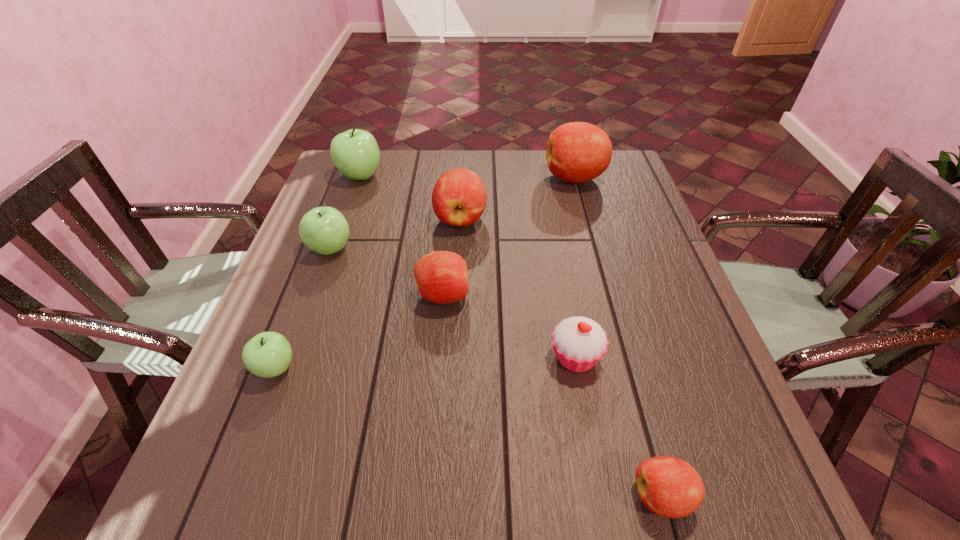
This screenshot has width=960, height=540. In order to click on the nearest object in this screenshot , I will do `click(668, 486)`.

The image size is (960, 540). I want to click on vacant space located 0.060m on the left of the biggest red apple, so point(525,178).

This screenshot has height=540, width=960. In order to click on free space located 0.210m on the front of the farthest green apple in this screenshot , I will do `click(340, 235)`.

At what (x,y) coordinates should I click in order to perform the action: click on blank space located on the back of the second farthest red apple. Please return your answer as a coordinate pair (x, y). This screenshot has width=960, height=540. Looking at the image, I should click on pos(463,172).

I want to click on vacant region located 0.330m on the back of the second smallest green apple, so click(360, 167).

Image resolution: width=960 pixels, height=540 pixels. Find the location of `free space located on the front of the third farthest red apple`. free space located on the front of the third farthest red apple is located at coordinates (432, 429).

What are the coordinates of `blank area located 0.060m on the right of the pink cupcake` in the screenshot? It's located at (633, 357).

I want to click on blank space located 0.270m on the right of the nearest green apple, so [x=436, y=368].

Locate an element on the screen. This screenshot has height=540, width=960. free space located 0.110m on the left of the nearest object is located at coordinates (564, 496).

Image resolution: width=960 pixels, height=540 pixels. In order to click on object that is at the near edge in this screenshot , I will do `click(668, 486)`.